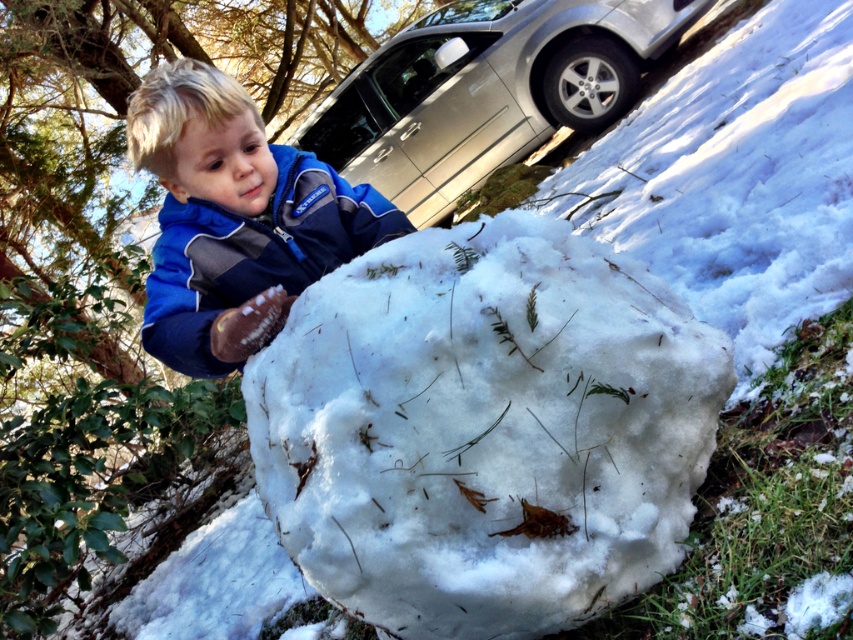
You are a delivery person trying to deliver a package to the address shown in the image. The package needs to be placed near the silver metallic car at upper center. However, there is a green leafy tree at center in the way. From the perspective of someone standing at the edge of the driveway, which object is closer to you?

The green leafy tree at center is closer to you than the silver metallic car at upper center because the tree is positioned below the car in the image, indicating it is in a lower, more forward plane.

You are standing at the point with coordinates point (151,280) and want to walk towards the point with coordinates point (132,355). Is there any obstacle between you and your destination?

Point (132,355) is behind point (151,280), so there is an obstacle between you and the destination.